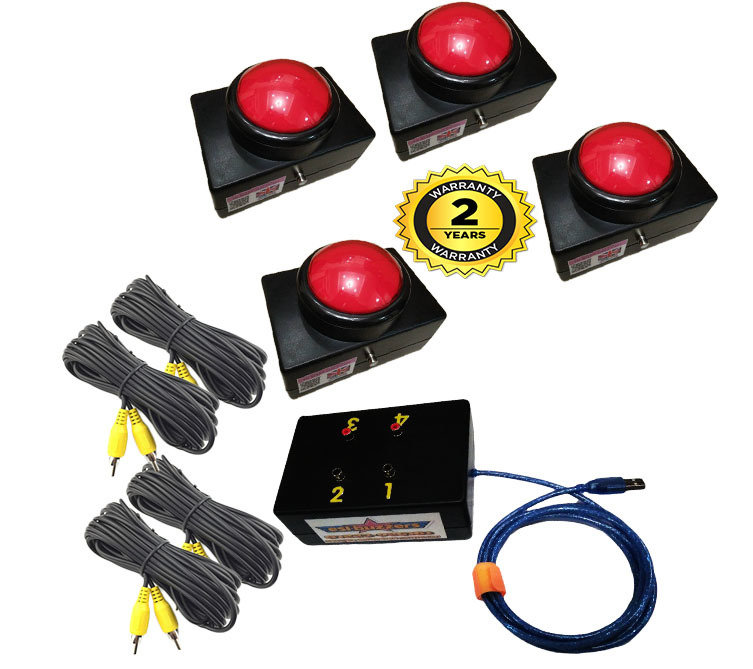
This screenshot has width=753, height=669. I want to click on wires, so click(x=575, y=363), click(x=177, y=566), click(x=212, y=506), click(x=165, y=389), click(x=202, y=341), click(x=617, y=534).